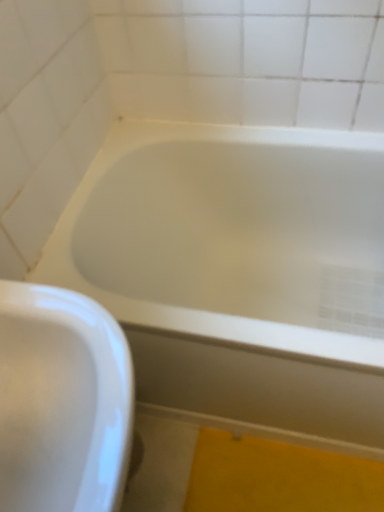
This screenshot has height=512, width=384. Describe the element at coordinates (62, 401) in the screenshot. I see `white glossy sink at lower left` at that location.

What is the approximate height of white glossy sink at lower left?

The height of white glossy sink at lower left is 33.10 inches.

The height and width of the screenshot is (512, 384). I want to click on white glossy sink at lower left, so click(62, 401).

Describe the element at coordinates (233, 268) in the screenshot. The height and width of the screenshot is (512, 384). I see `white glossy bathtub at center` at that location.

Find the location of a particular element. The width and height of the screenshot is (384, 512). white glossy bathtub at center is located at coordinates (x=233, y=268).

This screenshot has width=384, height=512. Identify the location of white glossy sink at lower left. (62, 401).

Between white glossy sink at lower left and white glossy bathtub at center, which one appears on the left side from the viewer's perspective?

Result: Positioned to the left is white glossy sink at lower left.

Considering their positions, is white glossy sink at lower left located in front of or behind white glossy bathtub at center?

white glossy sink at lower left is positioned closer to the viewer than white glossy bathtub at center.

Is point (85, 466) in front of point (186, 409)?

Yes, point (85, 466) is in front of point (186, 409).

From the image's perspective, relative to white glossy bathtub at center, is white glossy sink at lower left above or below?

white glossy sink at lower left is situated lower than white glossy bathtub at center in the image.

From a real-world perspective, is white glossy sink at lower left on top of white glossy bathtub at center?

Indeed, from a real-world perspective, white glossy sink at lower left stands above white glossy bathtub at center.

Considering the relative sizes of white glossy sink at lower left and white glossy bathtub at center in the image provided, is white glossy sink at lower left thinner than white glossy bathtub at center?

Correct, the width of white glossy sink at lower left is less than that of white glossy bathtub at center.

Consider the image. Which of these two, white glossy sink at lower left or white glossy bathtub at center, stands taller?

Standing taller between the two is white glossy sink at lower left.

Is white glossy sink at lower left bigger or smaller than white glossy bathtub at center?

white glossy sink at lower left is smaller than white glossy bathtub at center.

Is white glossy sink at lower left surrounding white glossy bathtub at center?

Actually, white glossy bathtub at center is outside white glossy sink at lower left.

Is there a large distance between white glossy sink at lower left and white glossy bathtub at center?

white glossy sink at lower left is near white glossy bathtub at center, not far away.

Could you tell me if white glossy sink at lower left is facing white glossy bathtub at center?

No, white glossy sink at lower left is not aimed at white glossy bathtub at center.

How many degrees apart are the facing directions of white glossy sink at lower left and white glossy bathtub at center?

The facing directions of white glossy sink at lower left and white glossy bathtub at center are 88.5 degrees apart.

Image resolution: width=384 pixels, height=512 pixels. In the image, there is a white glossy sink at lower left. Find the location of `bathtub below it (from a real-world perspective)`. bathtub below it (from a real-world perspective) is located at coordinates (233, 268).

Consider the image. Visually, is white glossy bathtub at center positioned to the left or to the right of white glossy sink at lower left?

white glossy bathtub at center is positioned on white glossy sink at lower left's right side.

In the scene shown: Who is more distant, white glossy bathtub at center or white glossy sink at lower left?

white glossy bathtub at center is further from the camera.

Between point (119, 211) and point (64, 448), which one is positioned in front?

Point (64, 448)

From the image's perspective, which is above, white glossy bathtub at center or white glossy sink at lower left?

white glossy bathtub at center, from the image's perspective.

From a real-world perspective, is white glossy bathtub at center below white glossy sink at lower left?

Indeed, from a real-world perspective, white glossy bathtub at center is positioned beneath white glossy sink at lower left.

Does white glossy bathtub at center have a lesser width compared to white glossy sink at lower left?

No.

From their relative heights in the image, would you say white glossy bathtub at center is taller or shorter than white glossy sink at lower left?

Considering their sizes, white glossy bathtub at center has less height than white glossy sink at lower left.

Who is bigger, white glossy bathtub at center or white glossy sink at lower left?

white glossy bathtub at center.

Can white glossy sink at lower left be found inside white glossy bathtub at center?

Actually, white glossy sink at lower left is outside white glossy bathtub at center.

Is white glossy bathtub at center far away from white glossy sink at lower left?

That's not correct — white glossy bathtub at center is a little close to white glossy sink at lower left.

Is white glossy bathtub at center oriented away from white glossy sink at lower left?

That's not correct — white glossy bathtub at center is not looking away from white glossy sink at lower left.

How much distance is there between white glossy bathtub at center and white glossy sink at lower left?

white glossy bathtub at center is 21.56 inches away from white glossy sink at lower left.

At what (x,y) coordinates should I click in order to perform the action: click on bathtub above the white glossy sink at lower left (from the image's perspective). Please return your answer as a coordinate pair (x, y). Looking at the image, I should click on (233, 268).

You are a GUI agent. You are given a task and a screenshot of the screen. Output one action in this format:
    pyautogui.click(x=<x>, y=<y>)
    Task: Click on the sink on the left of white glossy bathtub at center
    This screenshot has width=384, height=512.
    Given the screenshot: What is the action you would take?
    pyautogui.click(x=62, y=401)

In order to click on bathtub above the white glossy sink at lower left (from the image's perspective) in this screenshot , I will do `click(233, 268)`.